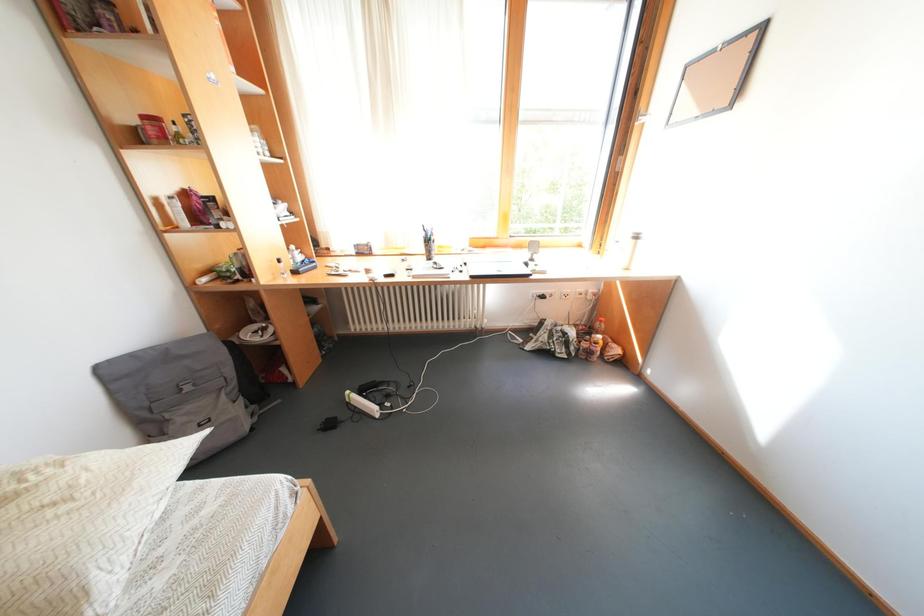
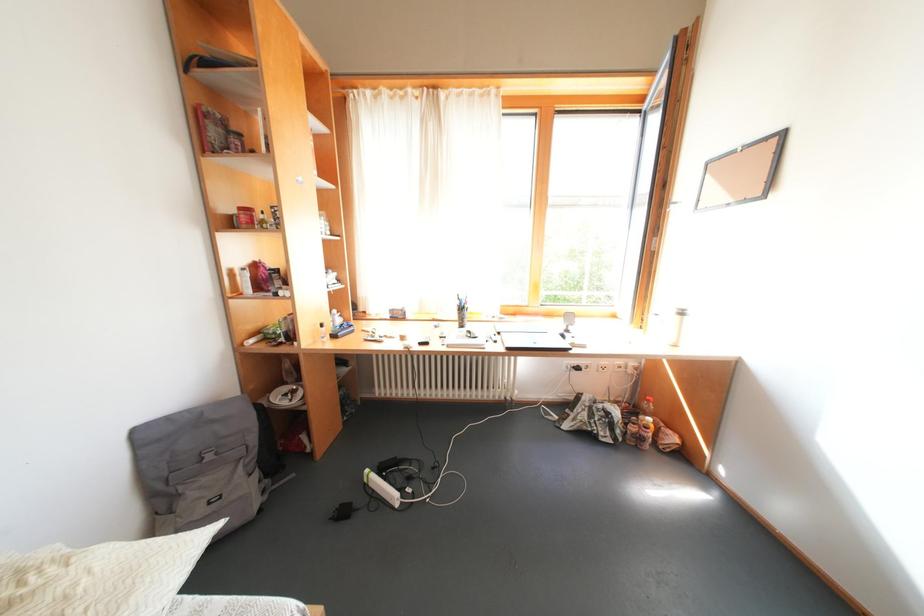
Question: Based on the continuous images, in which direction is the camera rotating? Reply with the corresponding letter.

Choices:
 (A) Left
 (B) Right
 (C) Up
 (D) Down

Answer: (C)